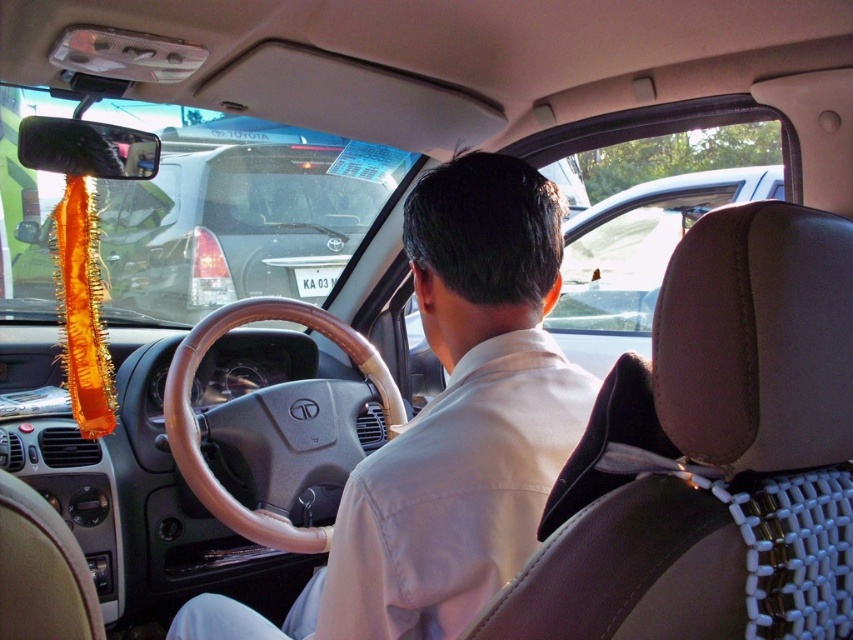
Identify the location of light beige leather shirt at center. (450, 426).

Can you confirm if light beige leather shirt at center is bigger than brown leather steering wheel at center?

Actually, light beige leather shirt at center might be smaller than brown leather steering wheel at center.

Does point (439, 472) come behind point (347, 408)?

No, it is not.

I want to click on light beige leather shirt at center, so click(x=450, y=426).